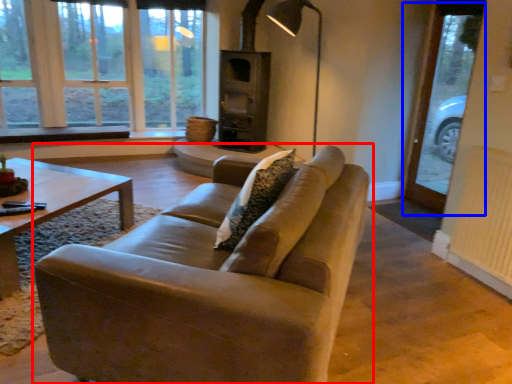
Question: Which object is further to the camera taking this photo, studio couch (highlighted by a red box) or screen door (highlighted by a blue box)?

Choices:
 (A) studio couch
 (B) screen door

Answer: (B)